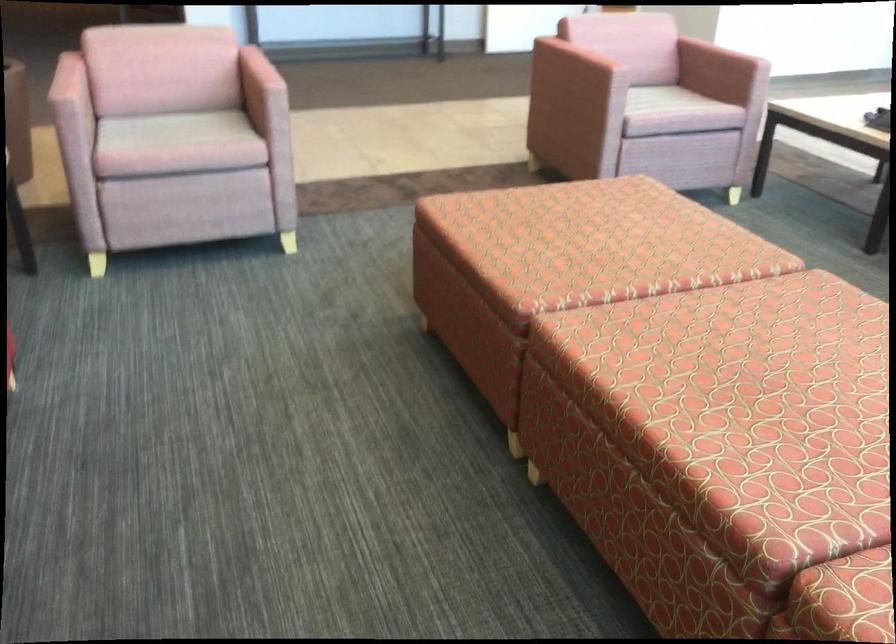
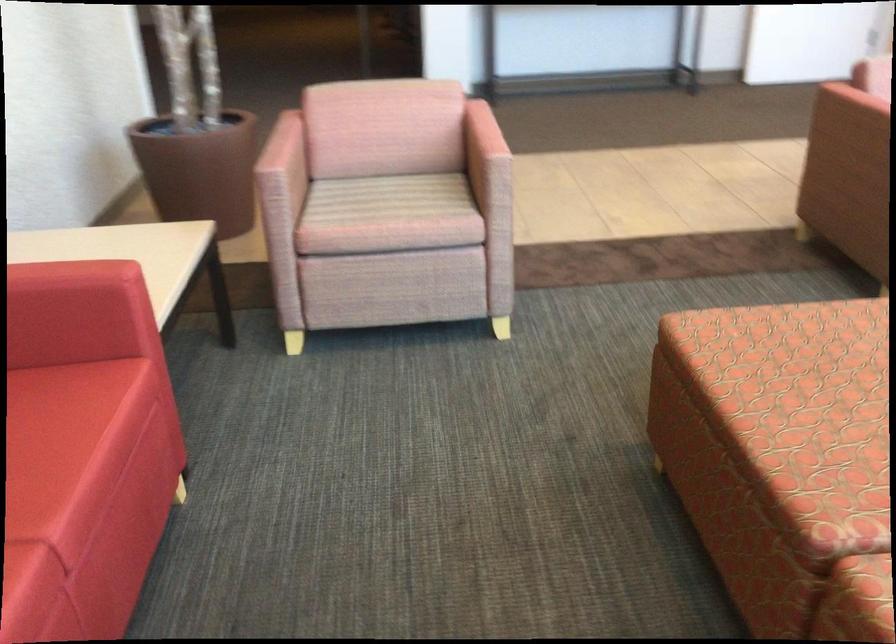
Question: I am providing you with two images of the same scene from different viewpoints. Please identify which objects are invisible in image2.

Choices:
 (A) pink chair armrest
 (B) patterned sofa sitting surface
 (C) red sofa armrest
 (D) none of these

Answer: (D)